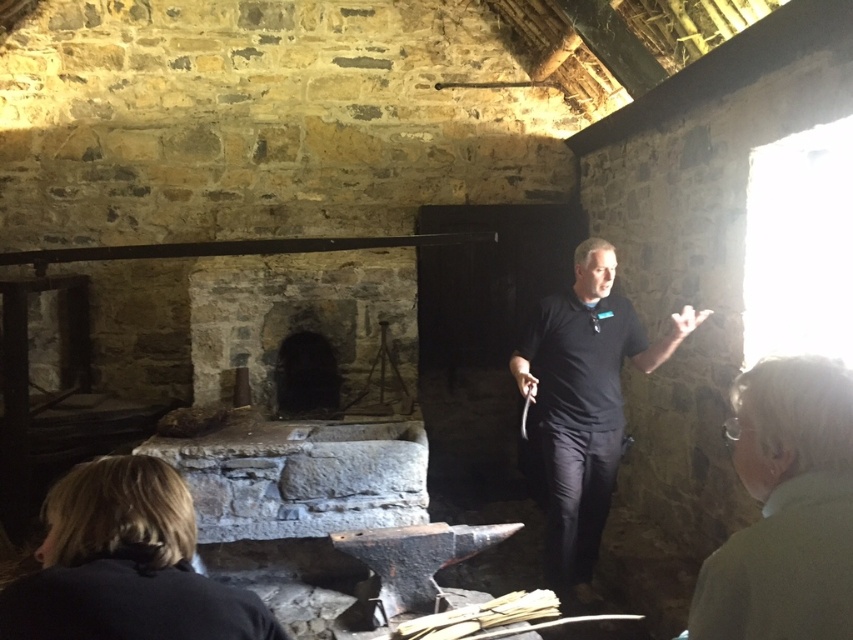
Question: Is black matte shirt at center above wooden beam at center?

Choices:
 (A) no
 (B) yes

Answer: (A)

Question: Which is nearer to the dark stone fireplace at center?

Choices:
 (A) blonde hair at lower left
 (B) black matte shirt at center
 (C) gray wool sweater at upper right
 (D) wooden beam at center

Answer: (D)

Question: Which object is closer to the camera taking this photo?

Choices:
 (A) black matte shirt at center
 (B) blonde hair at lower left

Answer: (B)

Question: Which point appears farthest from the camera in this image?

Choices:
 (A) (361, 244)
 (B) (585, 568)
 (C) (701, 588)

Answer: (A)

Question: Is gray wool sweater at upper right wider than wooden beam at center?

Choices:
 (A) yes
 (B) no

Answer: (B)

Question: Does gray wool sweater at upper right have a lesser width compared to wooden beam at center?

Choices:
 (A) no
 (B) yes

Answer: (B)